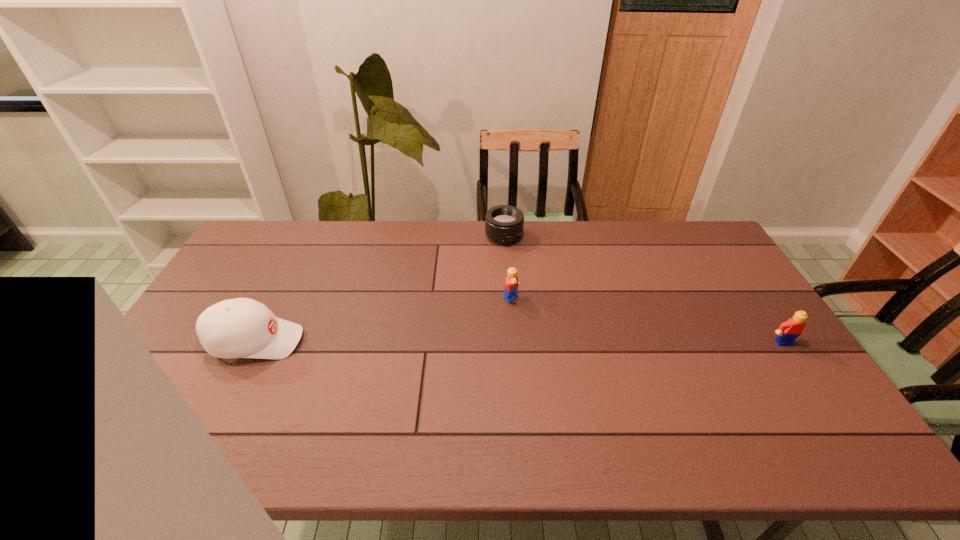
Where is `free space at the right edge of the desktop`? The height and width of the screenshot is (540, 960). free space at the right edge of the desktop is located at coordinates (717, 316).

I want to click on vacant space that's between the third nearest object and the baseball cap, so click(384, 320).

Image resolution: width=960 pixels, height=540 pixels. I want to click on vacant region between the right Lego and the left Lego, so click(648, 321).

What are the coordinates of `free space that is in between the telephoto lens and the baseball cap` in the screenshot? It's located at (379, 289).

At what (x,y) coordinates should I click in order to perform the action: click on free area in between the farthest object and the left Lego. Please return your answer as a coordinate pair (x, y). Looking at the image, I should click on (x=508, y=268).

Identify the location of vacant space that's between the right Lego and the telephoto lens. The image size is (960, 540). (644, 289).

Where is `free point between the baseball cap and the farther Lego`? free point between the baseball cap and the farther Lego is located at coordinates (384, 320).

Locate an element on the screen. This screenshot has width=960, height=540. free space between the shortest object and the farther Lego is located at coordinates (508, 268).

The height and width of the screenshot is (540, 960). I want to click on free space between the baseball cap and the left Lego, so click(x=384, y=320).

Locate an element on the screen. vacant area between the leftmost object and the telephoto lens is located at coordinates (379, 289).